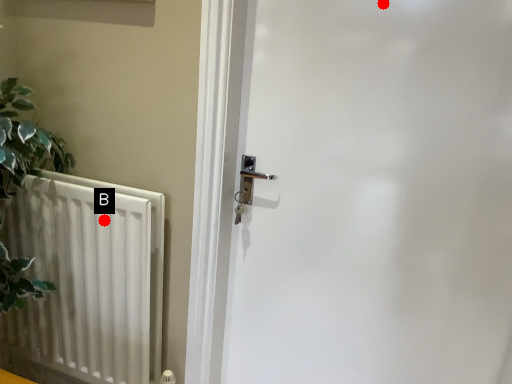
Question: Two points are circled on the image, labeled by A and B beside each circle. Which point appears closest to the camera in this image?

Choices:
 (A) A is closer
 (B) B is closer

Answer: (A)